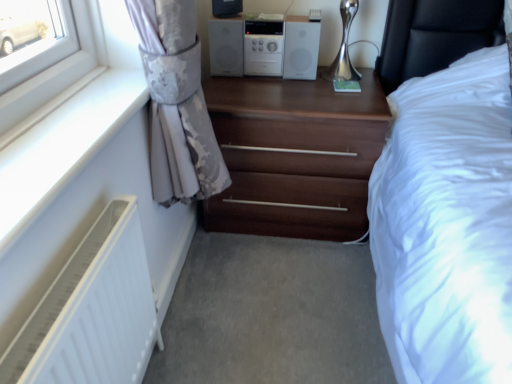
The image size is (512, 384). In order to click on free spot above dark wood chest of drawers at center (from a real-world perspective) in this screenshot , I will do `click(285, 93)`.